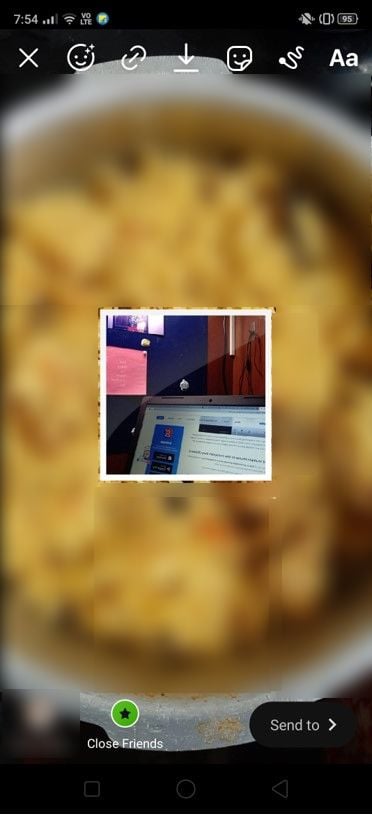
The width and height of the screenshot is (372, 817). I want to click on laptop, so click(x=188, y=420).